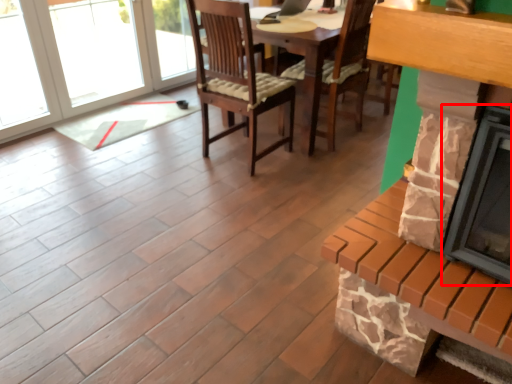
Question: From the image's perspective, considering the relative positions of fireplace (annotated by the red box) and fireplace in the image provided, where is fireplace (annotated by the red box) located with respect to the staircase?

Choices:
 (A) below
 (B) above

Answer: (B)